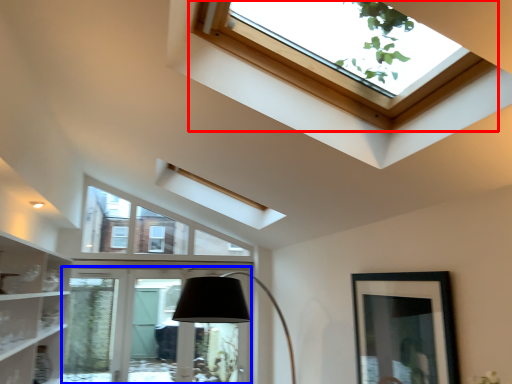
Question: Which of the following is the closest to the observer, window (highlighted by a red box) or glass door (highlighted by a blue box)?

Choices:
 (A) window
 (B) glass door

Answer: (A)